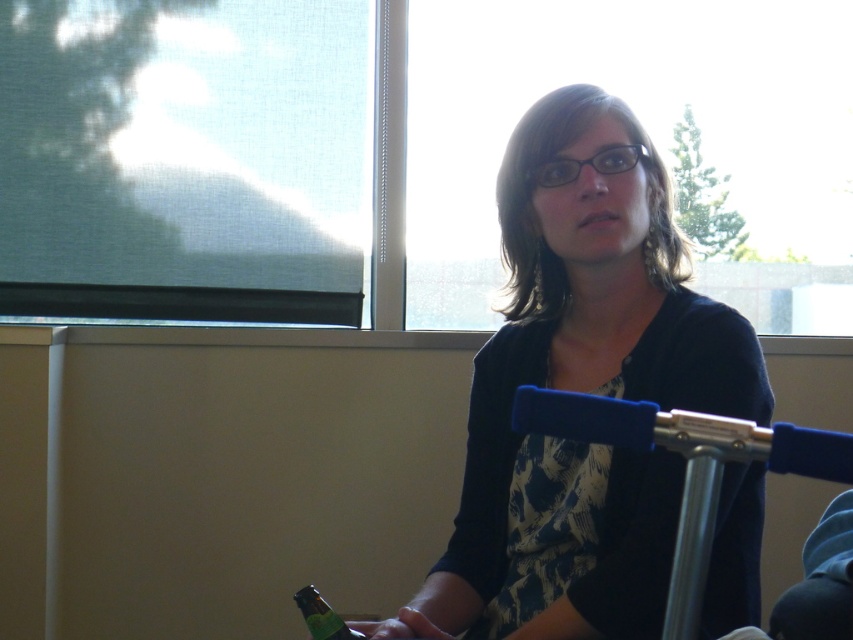
You are taking a photo of the scene and want to focus on both the point at (518, 147) and the point at (357, 630). Which point should you focus on first to ensure both are in focus?

You should focus on point (518, 147) first because it is closer to the camera than point (357, 630). This way, adjusting focus from near to far will help both points be in focus.

You are organizing a photo shoot and need to ensure proper lighting for both the matte black sweater at center and the green matte bottle at lower left. Since the light source is coming from the upper right corner, which object might cast a shadow over the other? Explain your reasoning based on their positions.

The matte black sweater at center is located above the green matte bottle at lower left. Since the light source is coming from the upper right corner, the sweater could cast a shadow over the bottle if positioned directly in the path of the light. This would depend on the angle and distance between the two objects, but given its higher position, the sweater is more likely to cast a shadow on the green matte bottle at lower left.

You are a photographer standing 1.2 meters away from the person in the image. You want to capture a closeup shot of the matte black sweater at center without moving the camera. Is the sweater within your camera lens range?

The matte black sweater at center is 1.05 meters from the camera, which is within the photographer standing 1.2 meters away. Therefore, the sweater is within the camera lens range.